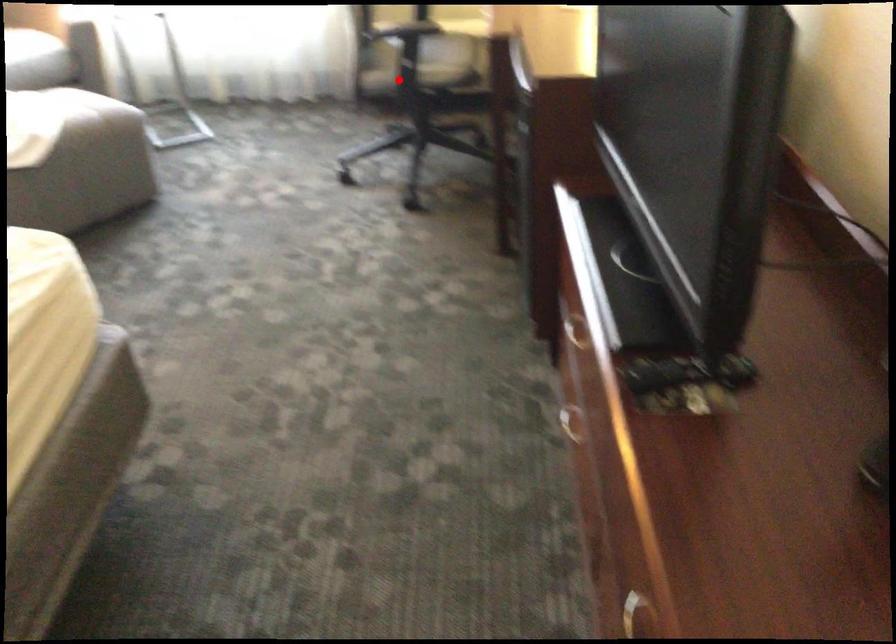
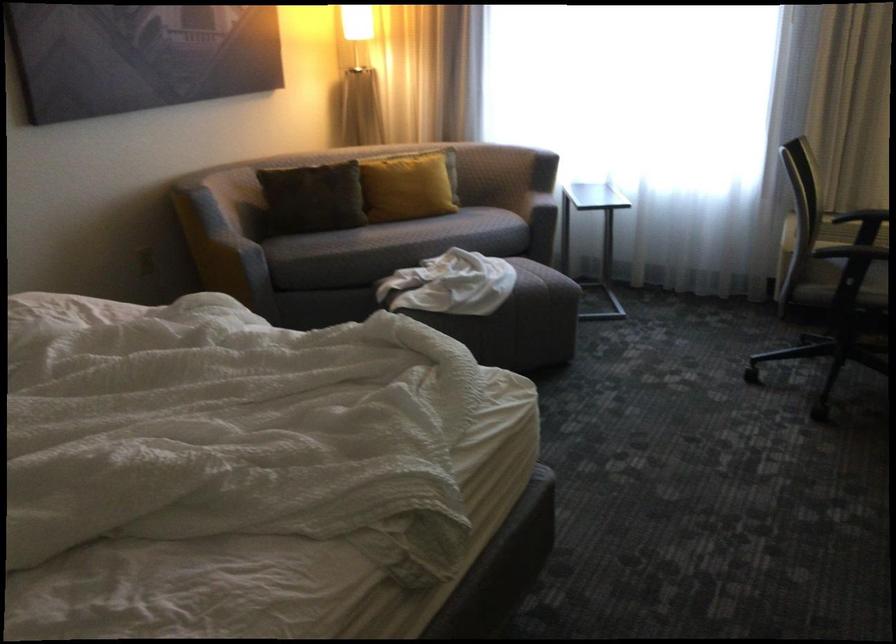
Where in the second image is the point corresponding to the highlighted location from the first image?

(831, 294)